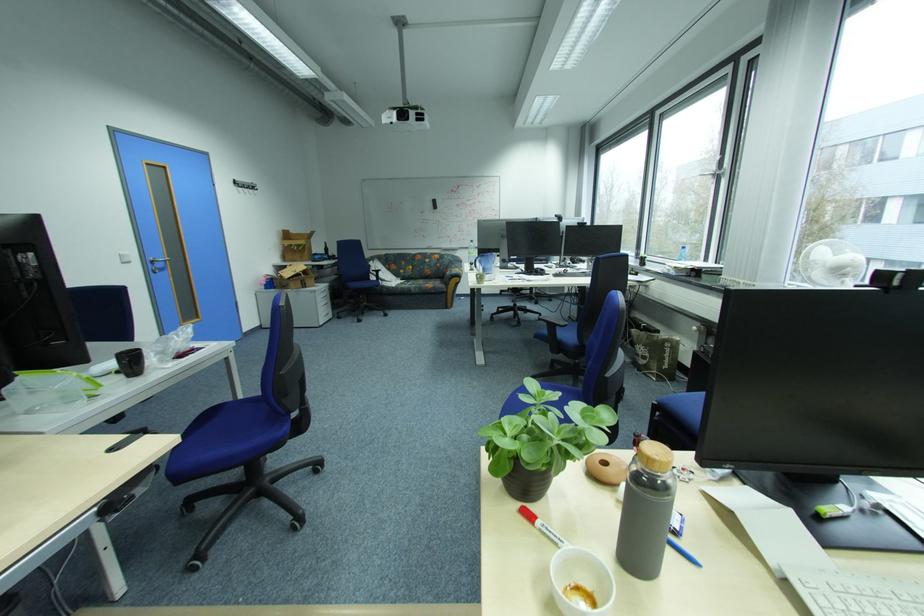
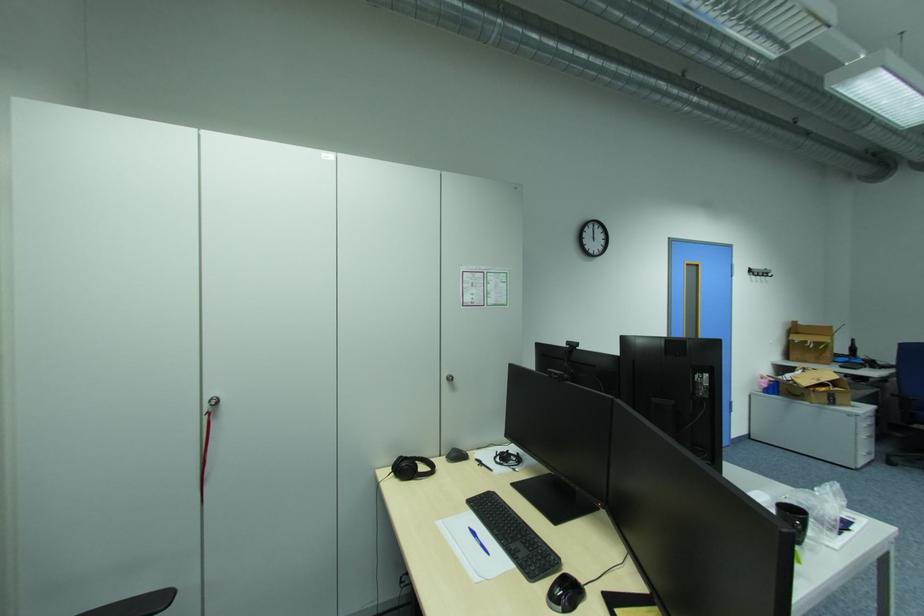
Where in the second image is the point corresponding to point (299, 233) from the first image?

(808, 323)